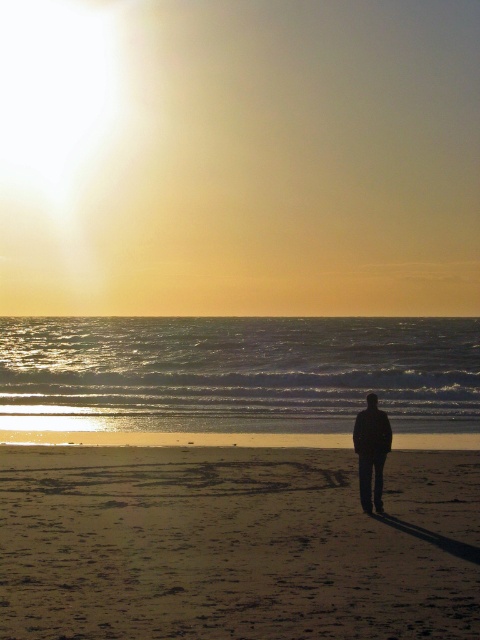
Does smooth golden sand at center appear on the left side of black matte jacket at center?

Correct, you'll find smooth golden sand at center to the left of black matte jacket at center.

Is the position of smooth golden sand at center less distant than that of black matte jacket at center?

Yes, smooth golden sand at center is in front of black matte jacket at center.

Does point (301, 484) come in front of point (375, 444)?

No.

Locate an element on the screen. The image size is (480, 640). smooth golden sand at center is located at coordinates (214, 548).